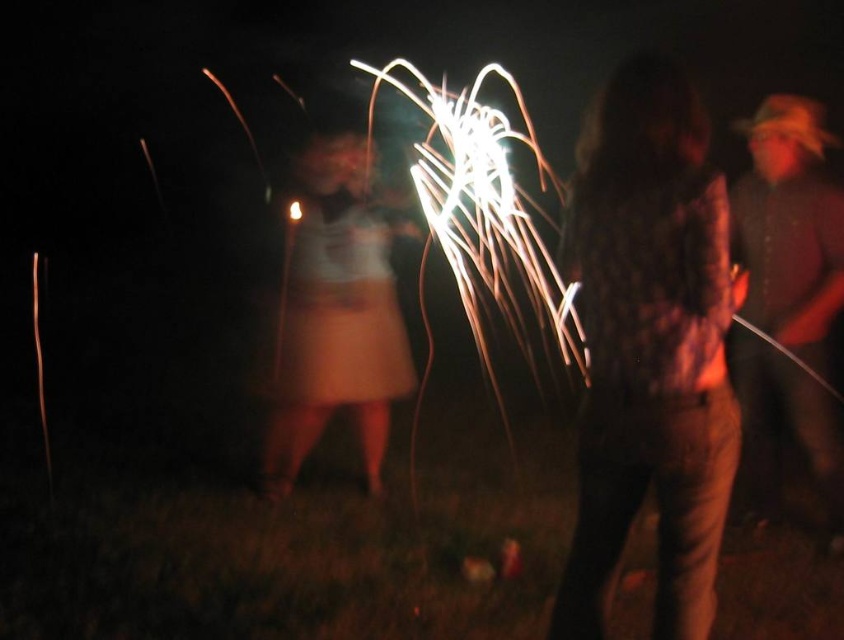
Question: Considering the real-world distances, which object is farthest from the white matte dress at center?

Choices:
 (A) brown textured shirt at right
 (B) fluffy brown coat at center

Answer: (B)

Question: Is fluffy brown coat at center smaller than white matte dress at center?

Choices:
 (A) no
 (B) yes

Answer: (B)

Question: Can you confirm if fluffy brown coat at center is positioned to the left of brown textured shirt at right?

Choices:
 (A) no
 (B) yes

Answer: (B)

Question: Among these objects, which one is farthest from the camera?

Choices:
 (A) brown textured shirt at right
 (B) white matte dress at center
 (C) fluffy brown coat at center

Answer: (B)

Question: Which point is closer to the camera?

Choices:
 (A) brown textured shirt at right
 (B) white matte dress at center
 (C) fluffy brown coat at center

Answer: (C)

Question: Is white matte dress at center positioned in front of brown textured shirt at right?

Choices:
 (A) no
 (B) yes

Answer: (A)